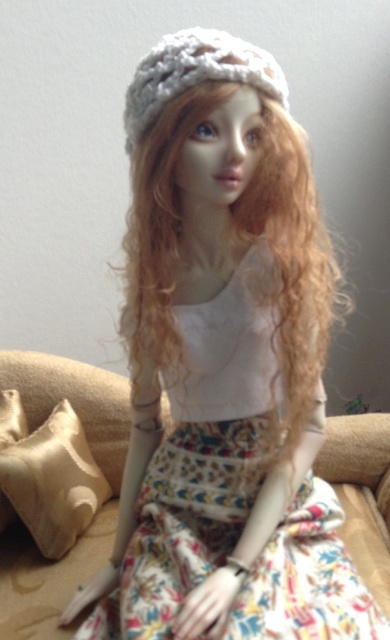
Question: Is curly blonde hair at center positioned at the back of beige fabric pillow at left?

Choices:
 (A) no
 (B) yes

Answer: (A)

Question: Does floral cotton dress at center lie behind beige fabric pillow at left?

Choices:
 (A) no
 (B) yes

Answer: (A)

Question: Based on their relative distances, which object is farther from the curly blonde hair at center?

Choices:
 (A) beige fabric pillow at left
 (B) floral cotton dress at center

Answer: (A)

Question: In this image, where is floral cotton dress at center located relative to curly blonde hair at center?

Choices:
 (A) left
 (B) right

Answer: (B)

Question: Which point is closer to the camera taking this photo?

Choices:
 (A) pos(308,316)
 (B) pos(219,61)

Answer: (B)

Question: Based on their relative distances, which object is farther from the floral cotton dress at center?

Choices:
 (A) white knitted hat at upper center
 (B) curly blonde hair at center
 (C) beige fabric pillow at left

Answer: (A)